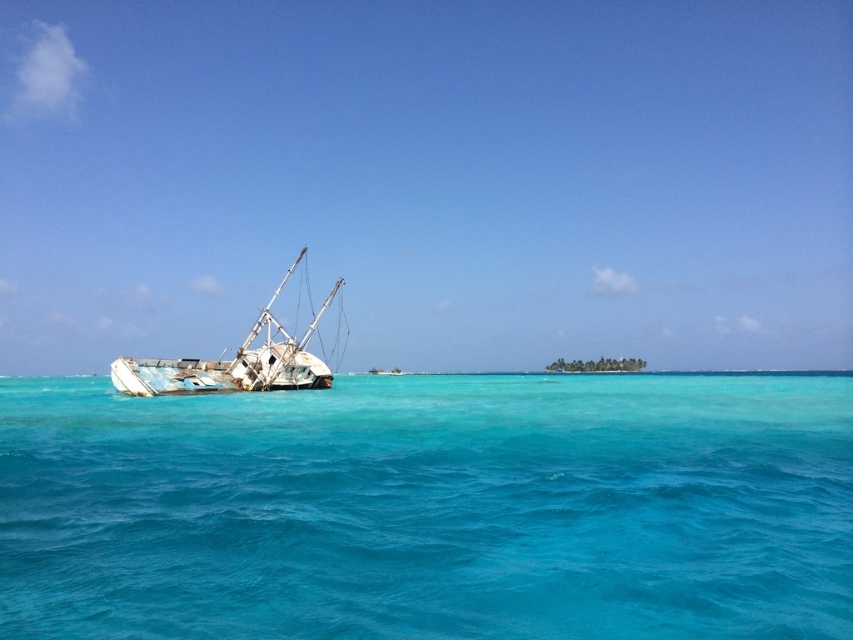
Is clear blue water at left shorter than rusty metal boat at left?

Yes, clear blue water at left is shorter than rusty metal boat at left.

Does point (47, 499) come behind point (297, 384)?

No.

Identify the location of clear blue water at left. This screenshot has width=853, height=640. (430, 508).